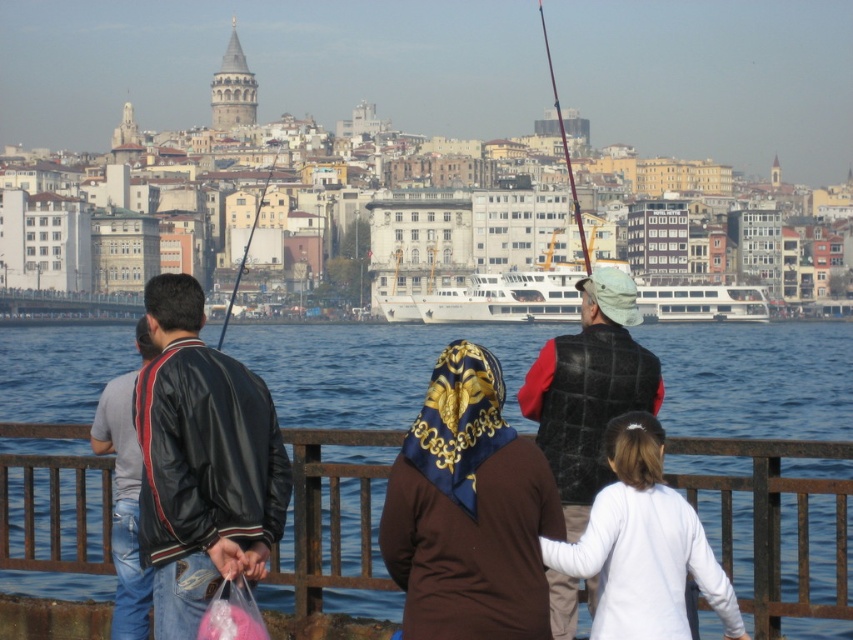
Is point (426, 634) positioned before point (138, 548)?

Yes, it is.

Is point (432, 378) farther from viewer compared to point (265, 426)?

Yes.

Find the location of a particular element. This screenshot has height=640, width=853. brown silk headscarf at center is located at coordinates (468, 509).

Does black leather jacket at left have a greater height compared to leather jacket at left?

No, black leather jacket at left is not taller than leather jacket at left.

Does black leather jacket at left have a larger size compared to leather jacket at left?

No.

Locate an element on the screen. black leather jacket at left is located at coordinates (202, 461).

Does quilted black vest at center have a lesser height compared to leather jacket at left?

Incorrect, quilted black vest at center's height does not fall short of leather jacket at left's.

Who is more distant from viewer, (602, 326) or (132, 531)?

Point (602, 326)

This screenshot has width=853, height=640. I want to click on quilted black vest at center, so click(x=589, y=388).